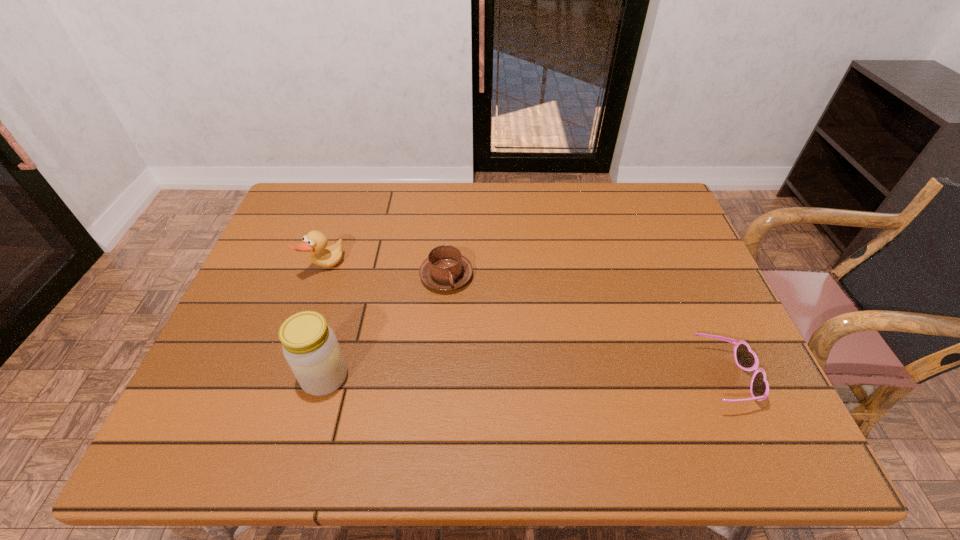
Locate an element on the screen. jar is located at coordinates (310, 346).

I want to click on the rightmost object, so click(x=746, y=359).

At what (x,y) coordinates should I click in order to perform the action: click on the shortest object. Please return your answer as a coordinate pair (x, y). This screenshot has width=960, height=540. Looking at the image, I should click on (746, 359).

At what (x,y) coordinates should I click in order to perform the action: click on the third shortest object. Please return your answer as a coordinate pair (x, y). Looking at the image, I should click on (314, 242).

The image size is (960, 540). What are the coordinates of `the third tallest object` in the screenshot? It's located at (445, 269).

Find the location of a particular element. The width and height of the screenshot is (960, 540). the third object from left to right is located at coordinates (445, 269).

Where is `vacant space situated on the right of the jar`? The image size is (960, 540). vacant space situated on the right of the jar is located at coordinates (397, 377).

This screenshot has height=540, width=960. What are the coordinates of `free space located 0.340m on the beak of the second tallest object` in the screenshot? It's located at (428, 341).

Locate an element on the screen. This screenshot has width=960, height=540. vacant area located 0.220m on the beak of the second tallest object is located at coordinates (393, 316).

Locate an element on the screen. Image resolution: width=960 pixels, height=540 pixels. vacant space located 0.290m on the beak of the second tallest object is located at coordinates (413, 330).